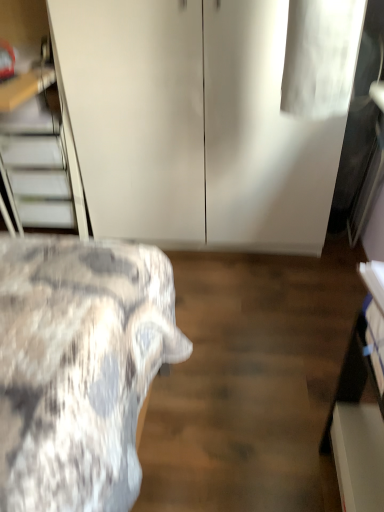
Question: Does point (38, 178) appear closer or farther from the camera than point (120, 113)?

Choices:
 (A) closer
 (B) farther

Answer: (B)

Question: From the image's perspective, is metallic silver stairs at left above or below white matte cabinet at center?

Choices:
 (A) above
 (B) below

Answer: (B)

Question: Is metallic silver stairs at left spatially inside white matte cabinet at center, or outside of it?

Choices:
 (A) outside
 (B) inside

Answer: (A)

Question: Is white matte cabinet at center inside or outside of metallic silver stairs at left?

Choices:
 (A) inside
 (B) outside

Answer: (B)

Question: From the image's perspective, is white matte cabinet at center positioned above or below metallic silver stairs at left?

Choices:
 (A) below
 (B) above

Answer: (B)

Question: Is white matte cabinet at center to the left or to the right of metallic silver stairs at left in the image?

Choices:
 (A) right
 (B) left

Answer: (A)

Question: From a real-world perspective, is white matte cabinet at center above or below metallic silver stairs at left?

Choices:
 (A) above
 (B) below

Answer: (A)